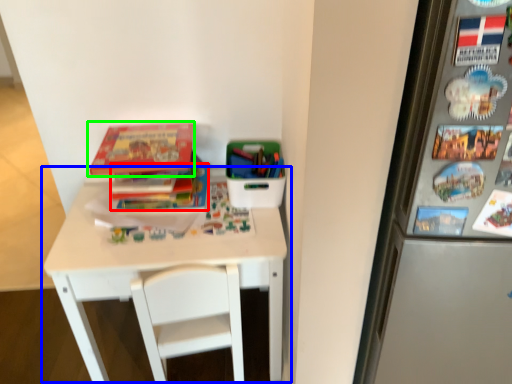
Question: Considering the real-world distances, which object is farthest from book (highlighted by a red box)? table (highlighted by a blue box) or book (highlighted by a green box)?

Choices:
 (A) table
 (B) book

Answer: (A)